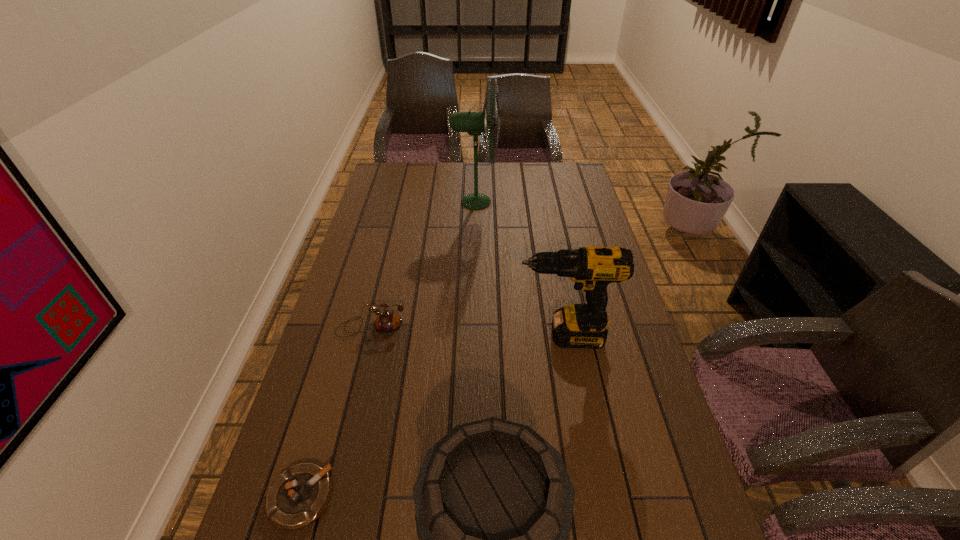
The width and height of the screenshot is (960, 540). What are the coordinates of `fan` in the screenshot? It's located at (474, 123).

I want to click on the tallest object, so click(x=474, y=123).

I want to click on drill, so click(x=592, y=268).

At what (x,y) coordinates should I click in order to perform the action: click on the fourth tallest object. Please return your answer as a coordinate pair (x, y). The width and height of the screenshot is (960, 540). Looking at the image, I should click on (387, 321).

At what (x,y) coordinates should I click in order to perform the action: click on the shortest object. Please return your answer as a coordinate pair (x, y). Image resolution: width=960 pixels, height=540 pixels. Looking at the image, I should click on (298, 496).

Where is `free space located 0.310m on the front-facing side of the tallest object`? This screenshot has width=960, height=540. free space located 0.310m on the front-facing side of the tallest object is located at coordinates (574, 202).

Identify the location of vacant area located 0.130m at the tip of the drill. (470, 336).

Identify the location of free point located 0.100m at the tip of the drill. (481, 336).

You are a GUI agent. You are given a task and a screenshot of the screen. Output one action in this format:
    pyautogui.click(x=<x>, y=<y>)
    Task: Click on the vacant space located 0.360m at the tip of the drill
    The height and width of the screenshot is (540, 960).
    Given the screenshot: What is the action you would take?
    pyautogui.click(x=391, y=336)

You are a GUI agent. You are given a task and a screenshot of the screen. Output one action in this format:
    pyautogui.click(x=<x>, y=<y>)
    Task: Click on the vacant space located 0.190m on the rotary dial of the telephone
    This screenshot has height=540, width=960.
    Given the screenshot: What is the action you would take?
    pyautogui.click(x=353, y=401)